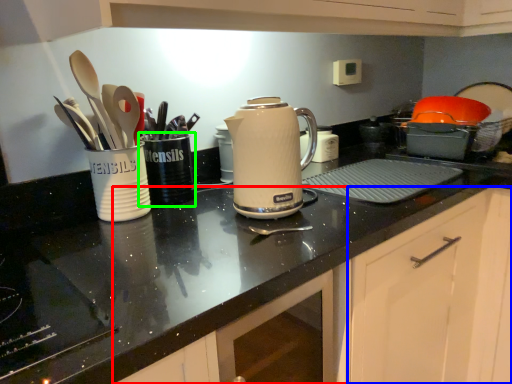
Question: Which is farther away from cabinetry (highlighted by a red box)? cabinetry (highlighted by a blue box) or tableware (highlighted by a green box)?

Choices:
 (A) cabinetry
 (B) tableware

Answer: (B)